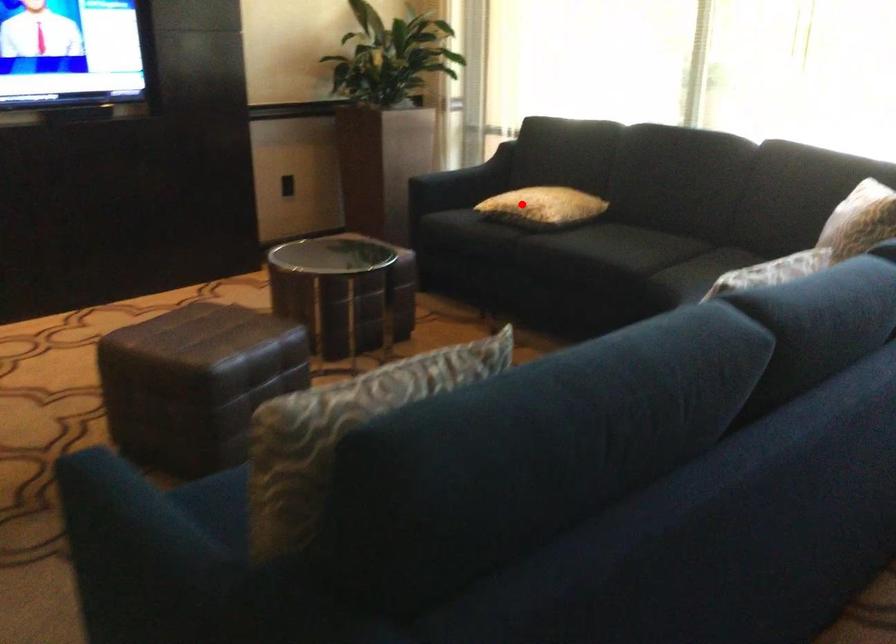
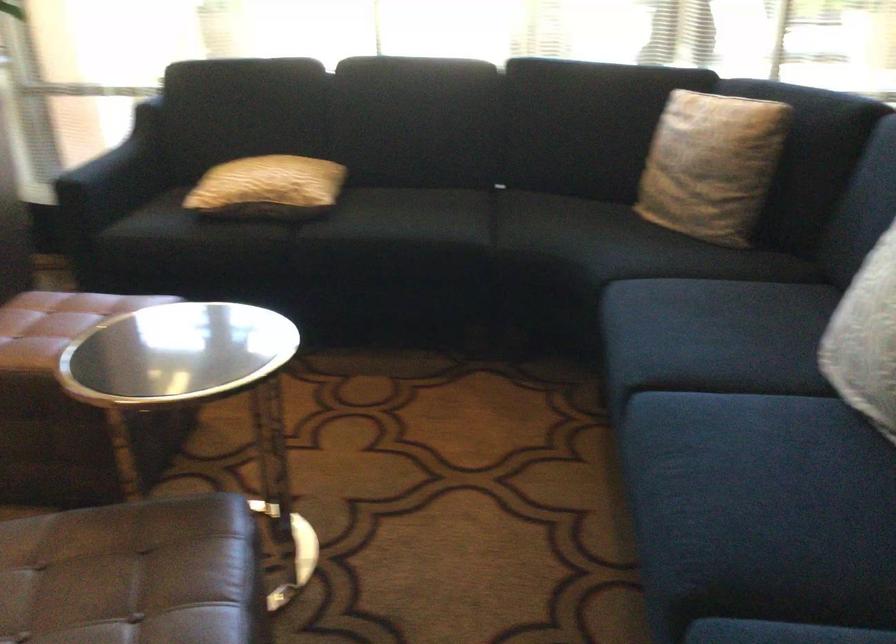
Locate, in the second image, the point that corresponds to the highlighted location in the first image.

(268, 187)